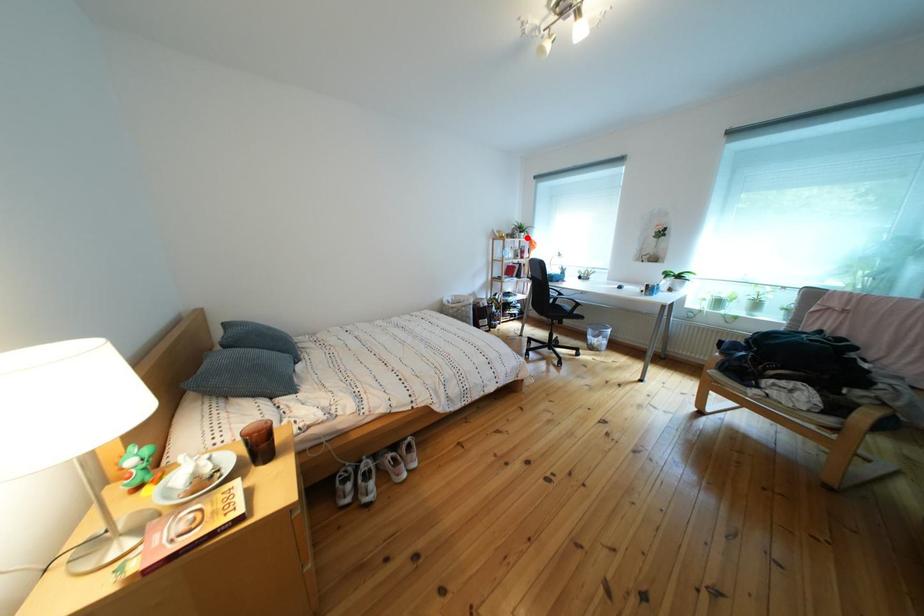
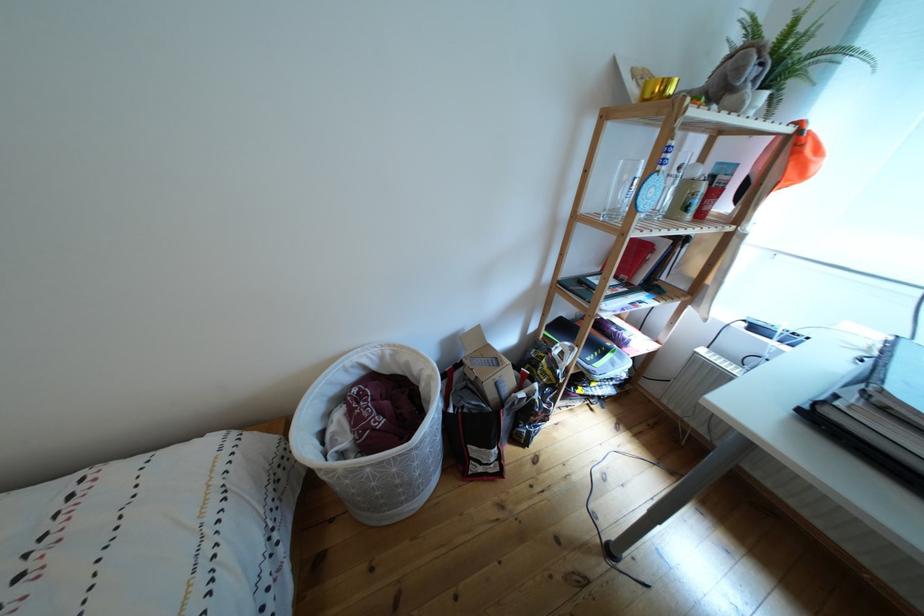
Question: A red point is marked in image1. In image2, is the corresponding 3D point closer to the camera or farther? Reply with the corresponding letter.

Choices:
 (A) The corresponding 3D point is closer.
 (B) The corresponding 3D point is farther.

Answer: (B)